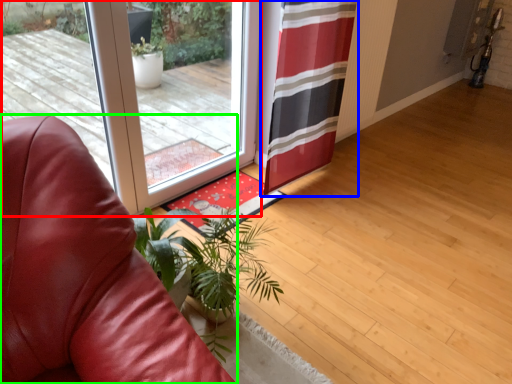
Question: Which is farther away from door (highlighted by a red box)? curtain (highlighted by a blue box) or chair (highlighted by a green box)?

Choices:
 (A) curtain
 (B) chair

Answer: (B)